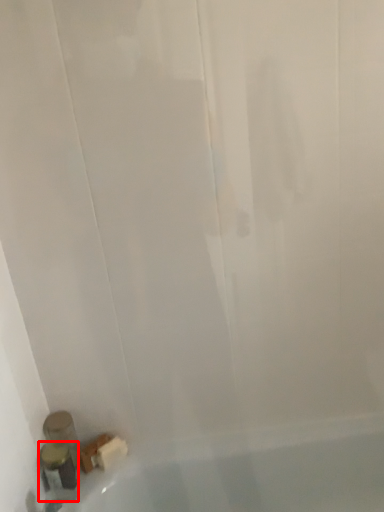
Question: Considering the relative positions of toiletry (annotated by the red box) and toiletry in the image provided, where is toiletry (annotated by the red box) located with respect to the staircase?

Choices:
 (A) left
 (B) right

Answer: (B)